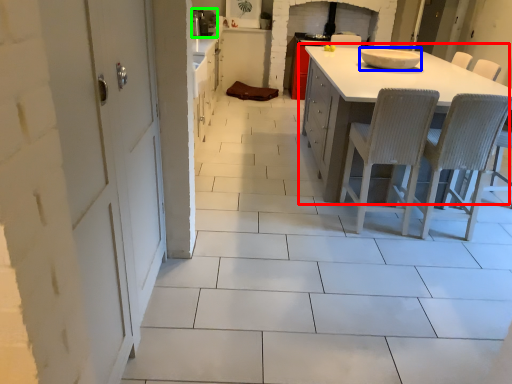
Question: Which object is positioned closest to table (highlighted by a red box)? Select from appliance (highlighted by a blue box) and appliance (highlighted by a green box).

Choices:
 (A) appliance
 (B) appliance

Answer: (A)